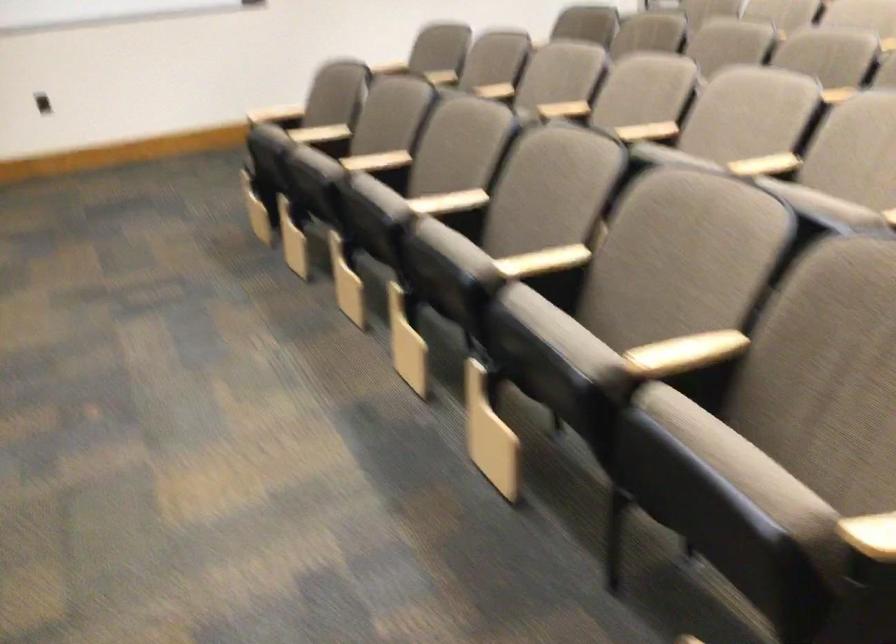
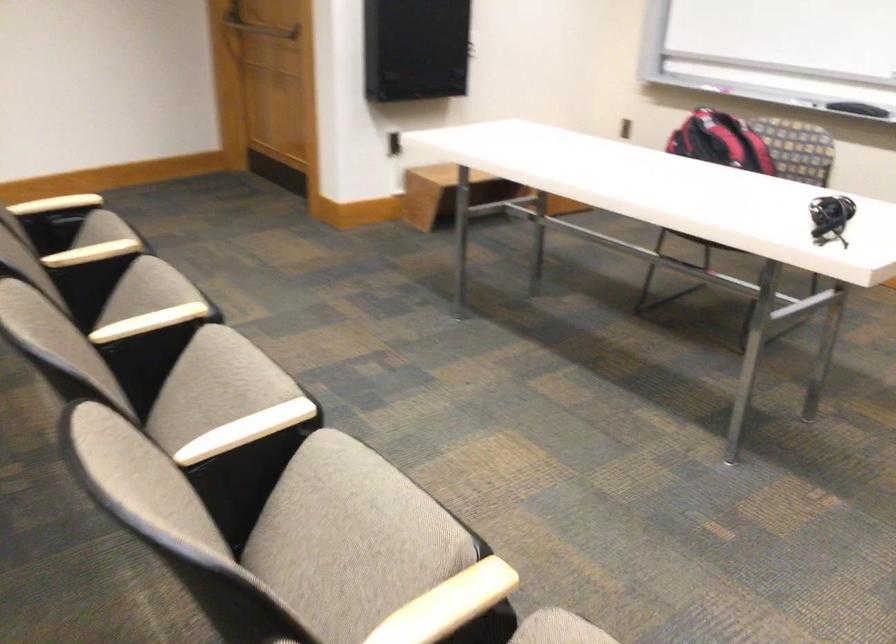
Where in the second image is the point corresponding to pixel 426 199 from the first image?

(245, 430)